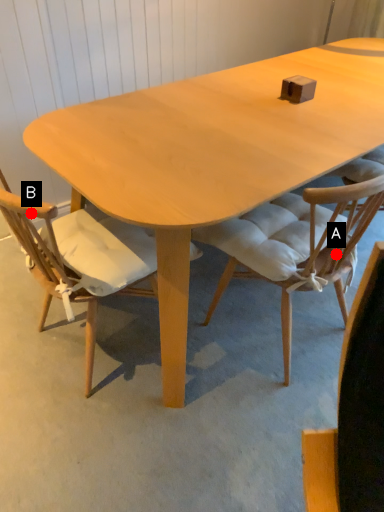
Question: Two points are circled on the image, labeled by A and B beside each circle. Which point is closer to the camera taking this photo?

Choices:
 (A) A is closer
 (B) B is closer

Answer: (B)